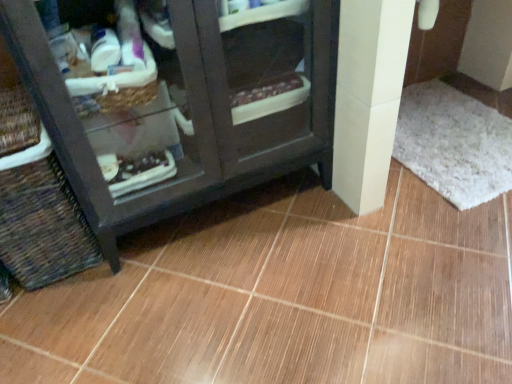
Question: From the image's perspective, is white shaggy bath mat at lower right positioned above or below dark wood cabinet at lower left?

Choices:
 (A) above
 (B) below

Answer: (B)

Question: Which is correct: white shaggy bath mat at lower right is inside dark wood cabinet at lower left, or outside of it?

Choices:
 (A) outside
 (B) inside

Answer: (A)

Question: Based on their relative distances, which object is farther from the woven brown basket at lower left?

Choices:
 (A) brown glossy tile at center
 (B) dark wood cabinet at lower left
 (C) white shaggy bath mat at lower right

Answer: (C)

Question: Estimate the real-world distances between objects in this image. Which object is farther from the woven brown basket at lower left?

Choices:
 (A) brown glossy tile at center
 (B) white shaggy bath mat at lower right
 (C) dark wood cabinet at lower left

Answer: (B)